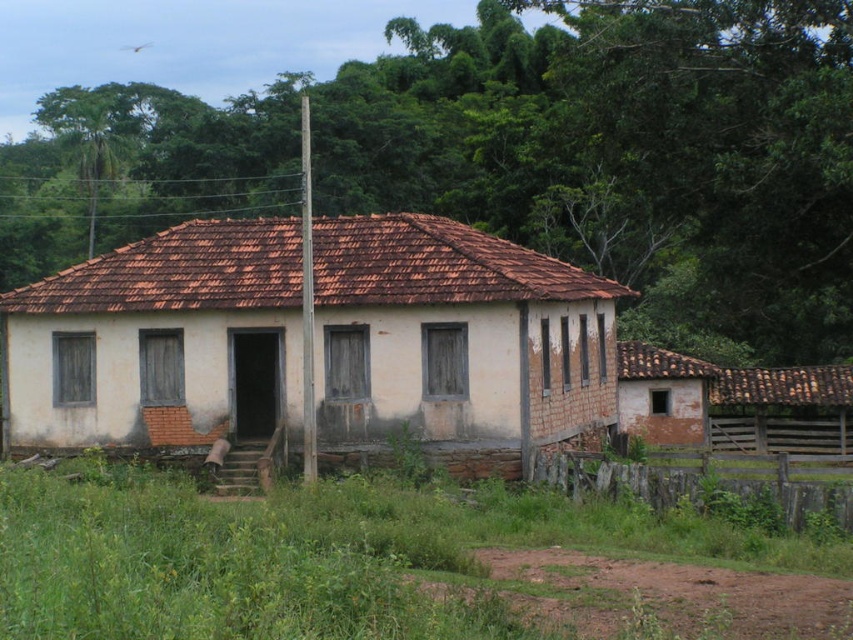
You are standing at the entrance of the building and want to know the exact position of the white plastered wall at center. Can you determine its coordinates based on the scene?

The white plastered wall at center is located at point coordinates of (x=456, y=340).

You are a painter who needs to assess the surfaces to paint. Given the white plastered wall at center and the brown wooden fence at lower right, which one has a larger surface area that requires more paint?

The white plastered wall at center has a larger surface area than the brown wooden fence at lower right, so it requires more paint.